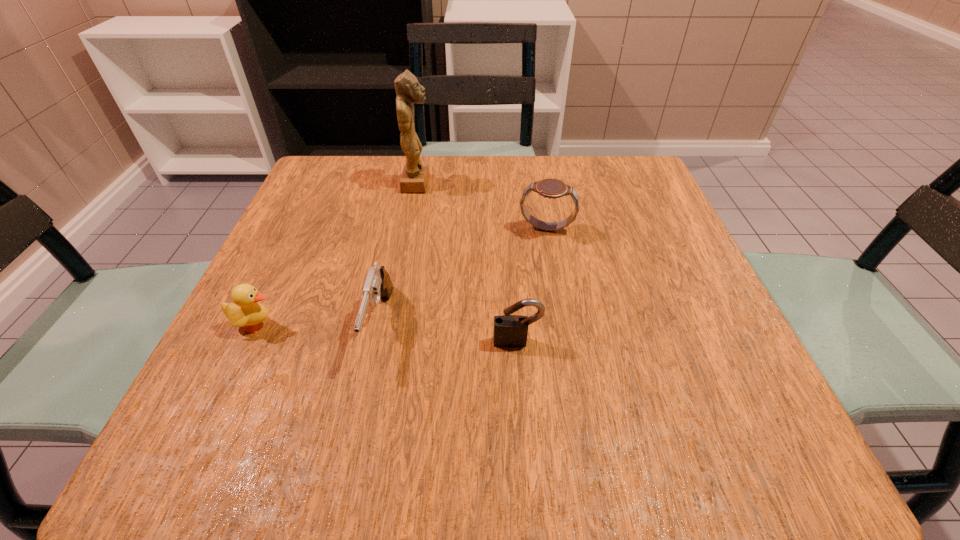
What are the coordinates of `free spot located on the front-facing side of the leftmost object` in the screenshot? It's located at (358, 325).

Find the location of a particular element. This screenshot has width=960, height=540. object that is at the far edge is located at coordinates (415, 175).

Identify the location of object that is at the left edge. (245, 311).

Where is `vacant space at the far edge of the desktop`? The width and height of the screenshot is (960, 540). vacant space at the far edge of the desktop is located at coordinates click(x=499, y=171).

Where is `vacant space at the near edge of the desktop`? This screenshot has height=540, width=960. vacant space at the near edge of the desktop is located at coordinates (348, 419).

Locate an element on the screen. The width and height of the screenshot is (960, 540). blank space at the left edge of the desktop is located at coordinates (300, 217).

This screenshot has width=960, height=540. I want to click on vacant space at the right edge of the desktop, so click(x=706, y=326).

In the image, there is a desktop. Identify the location of vacant region at the near left corner. This screenshot has width=960, height=540. (225, 440).

In the image, there is a desktop. Find the location of `vacant space at the far right corner`. vacant space at the far right corner is located at coordinates (623, 211).

Identify the location of blank space at the near right corner of the desktop. (670, 431).